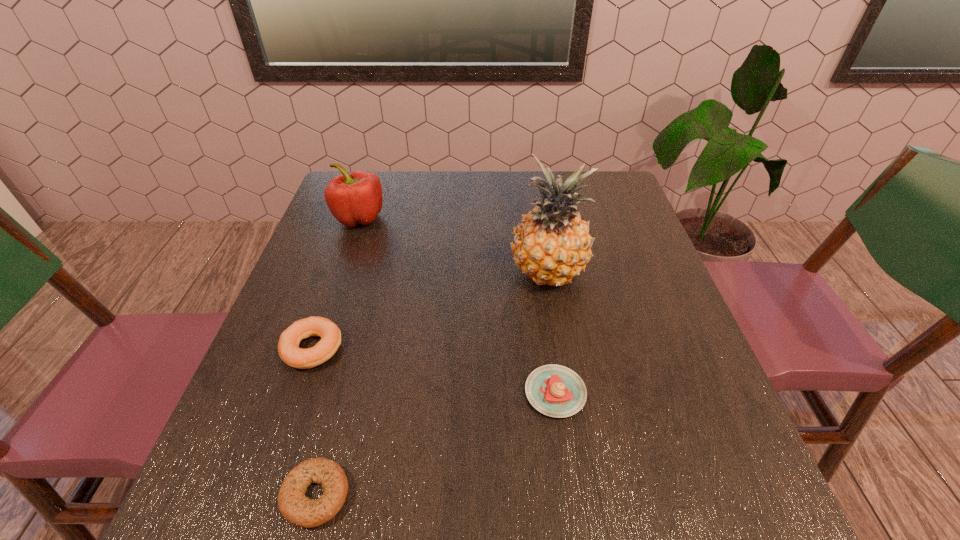
Locate an element on the screen. The image size is (960, 540). free space located 0.150m on the front of the farthest object is located at coordinates (341, 272).

Where is `vacant region located 0.350m on the right of the taller bagel`? Image resolution: width=960 pixels, height=540 pixels. vacant region located 0.350m on the right of the taller bagel is located at coordinates (515, 349).

Where is `vacant space located 0.270m on the left of the pastry`? This screenshot has height=540, width=960. vacant space located 0.270m on the left of the pastry is located at coordinates (380, 393).

The image size is (960, 540). Identify the location of free space located 0.370m on the right of the nearest object. (587, 495).

At what (x,y) coordinates should I click in order to perform the action: click on object at the far edge. Please return your answer as a coordinate pair (x, y). Looking at the image, I should click on [x=356, y=198].

Locate an element on the screen. This screenshot has width=960, height=540. object that is at the near edge is located at coordinates (297, 509).

This screenshot has height=540, width=960. Find the location of `bell pepper located in the left edge section of the desktop`. bell pepper located in the left edge section of the desktop is located at coordinates (356, 198).

Find the location of `object at the far left corner`. object at the far left corner is located at coordinates point(356,198).

At what (x,y) coordinates should I click in order to perform the action: click on object present at the near left corner. Please return your answer as a coordinate pair (x, y). The image size is (960, 540). Looking at the image, I should click on (297, 509).

You are a GUI agent. You are given a task and a screenshot of the screen. Output one action in this format:
    pyautogui.click(x=<x>, y=<y>)
    Task: Click on the vacant space at the far edge
    This screenshot has height=540, width=960.
    Given the screenshot: What is the action you would take?
    pyautogui.click(x=529, y=212)